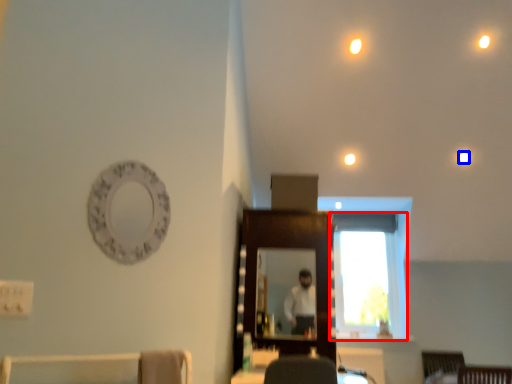
Question: Which object appears closest to the camera in this image, window (highlighted by a red box) or lighting (highlighted by a blue box)?

Choices:
 (A) window
 (B) lighting

Answer: (B)